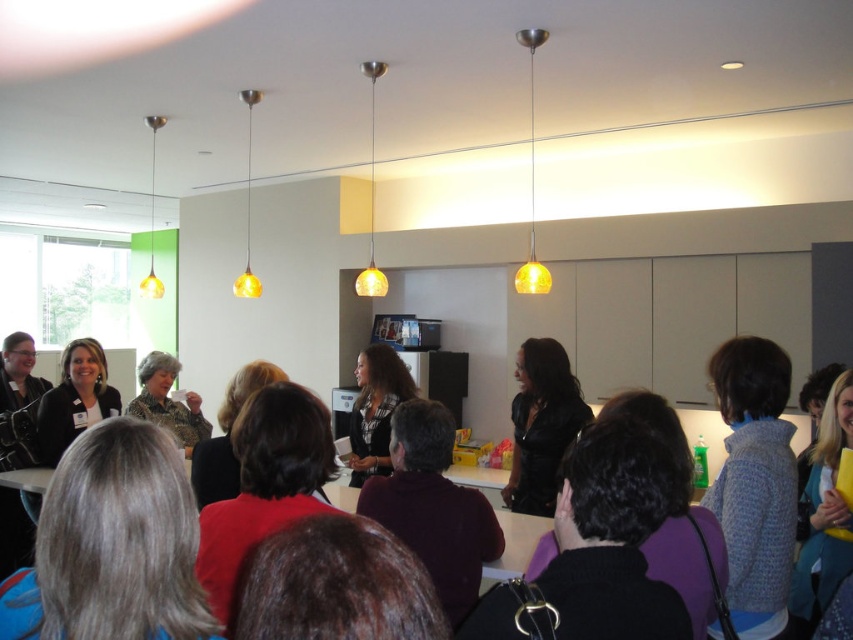
Is blonde hair at upper right taller than matte gold pendant light at center?

Yes.

Can you confirm if blonde hair at upper right is positioned to the right of matte gold pendant light at center?

Indeed, blonde hair at upper right is positioned on the right side of matte gold pendant light at center.

Where is `blonde hair at upper right`? blonde hair at upper right is located at coordinates click(x=822, y=515).

Is point (816, 518) closer to viewer compared to point (67, 410)?

Yes.

Is point (813, 600) in front of point (59, 445)?

Yes.

At what (x,y) coordinates should I click in order to perform the action: click on blonde hair at upper right. Please return your answer as a coordinate pair (x, y). The image size is (853, 640). Looking at the image, I should click on (822, 515).

Consider the image. Can you confirm if knitted blue sweater at right is smaller than matte black jacket at center?

Incorrect, knitted blue sweater at right is not smaller in size than matte black jacket at center.

Is knitted blue sweater at right to the left of matte black jacket at center from the viewer's perspective?

In fact, knitted blue sweater at right is to the right of matte black jacket at center.

This screenshot has width=853, height=640. What do you see at coordinates (753, 483) in the screenshot?
I see `knitted blue sweater at right` at bounding box center [753, 483].

Where is `knitted blue sweater at right`? The image size is (853, 640). knitted blue sweater at right is located at coordinates (753, 483).